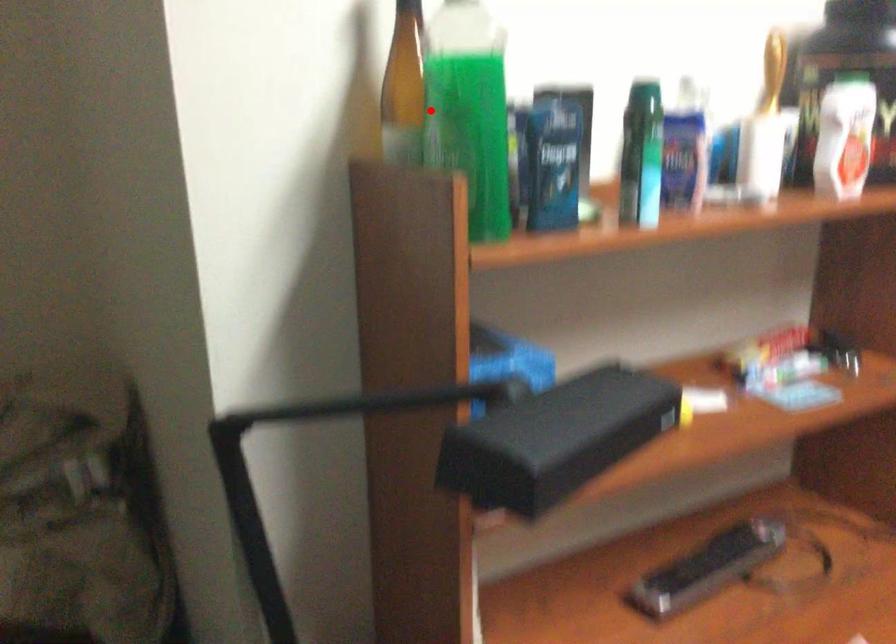
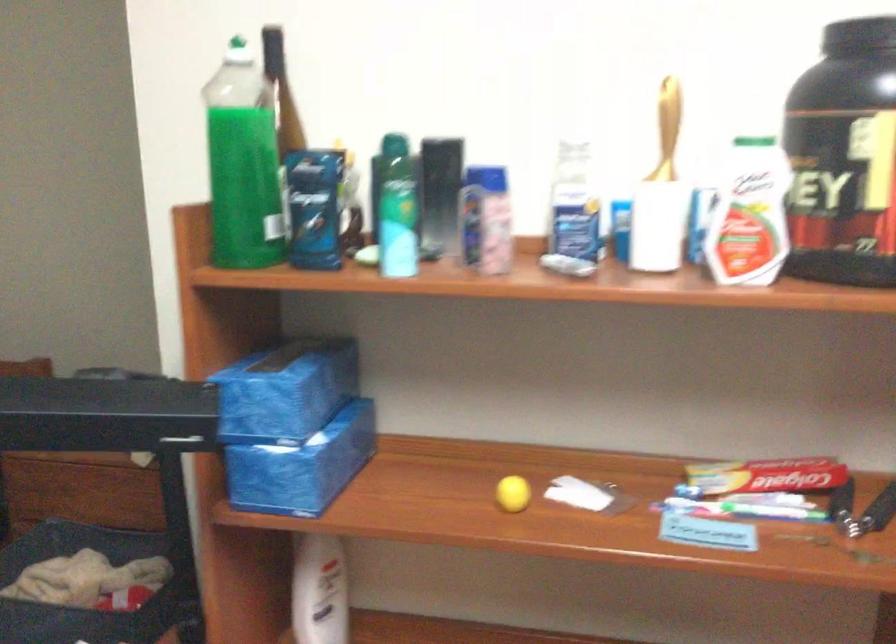
In the second image, find the point that corresponds to the highlighted location in the first image.

(243, 163)